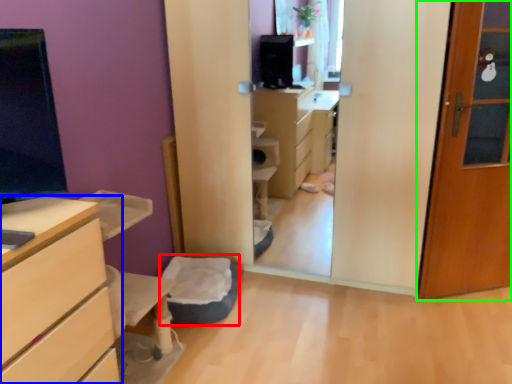
Question: Estimate the real-world distances between objects in this image. Which object is closer to flat (highlighted by a red box), chest of drawers (highlighted by a blue box) or door (highlighted by a green box)?

Choices:
 (A) chest of drawers
 (B) door

Answer: (A)